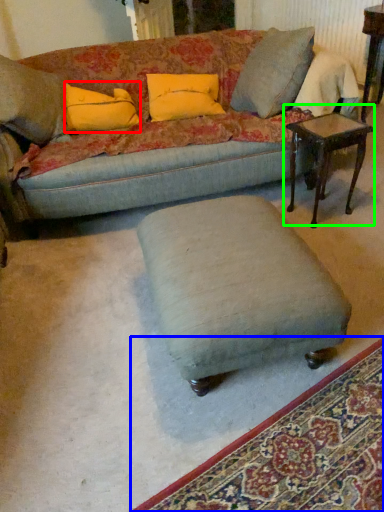
Question: Estimate the real-world distances between objects in this image. Which object is farther from pillow (highlighted by a red box), mat (highlighted by a blue box) or table (highlighted by a green box)?

Choices:
 (A) mat
 (B) table

Answer: (A)